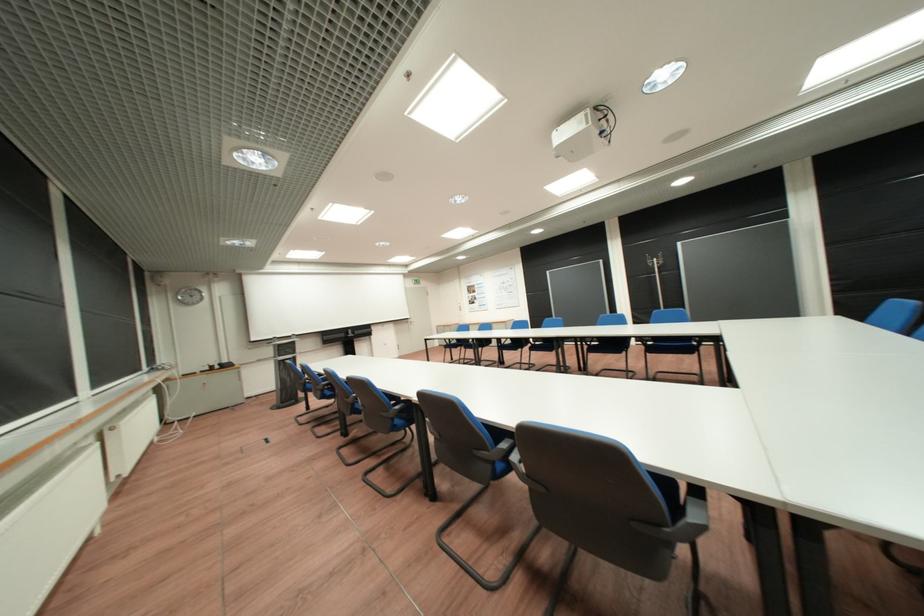
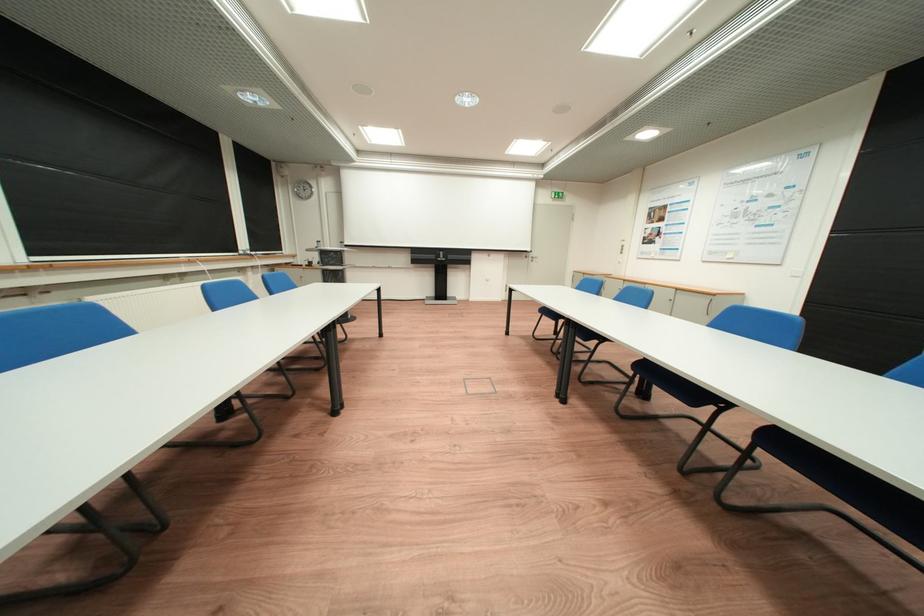
The point at (356, 337) is marked in the first image. Where is the corresponding point in the second image?

(445, 257)